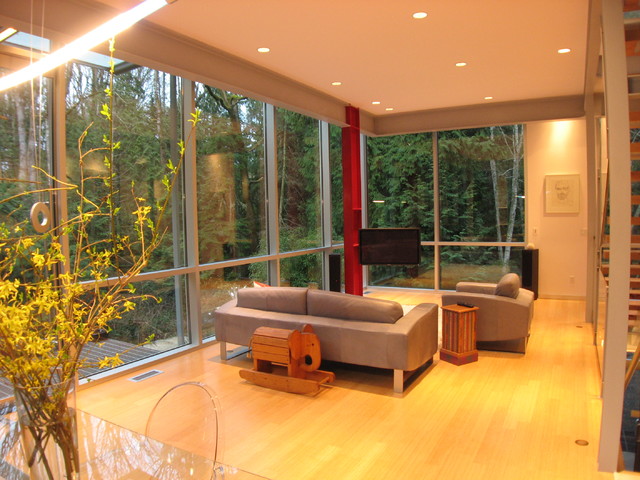
Where is `ceiling`? The height and width of the screenshot is (480, 640). ceiling is located at coordinates (356, 61).